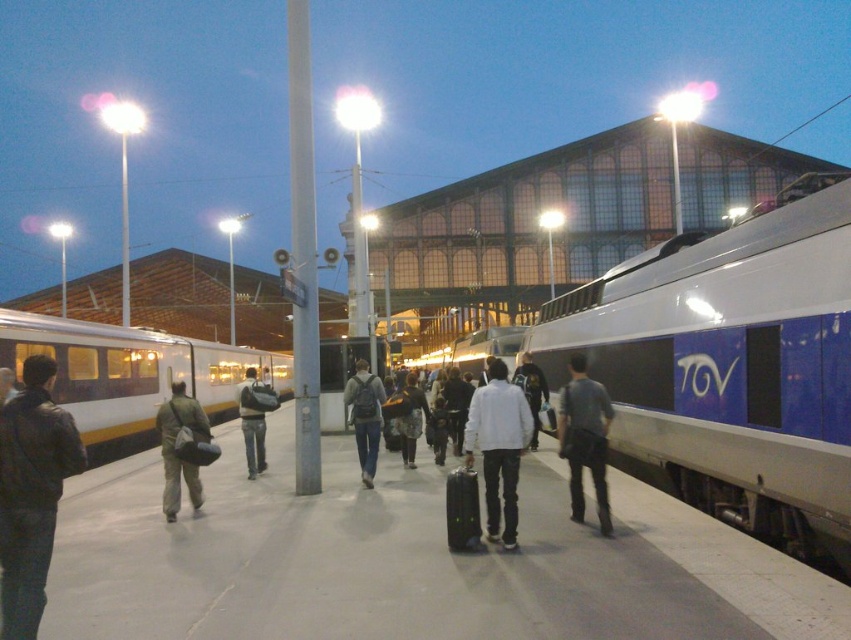
Question: Is white matte jacket at center below silver metallic train at center?

Choices:
 (A) no
 (B) yes

Answer: (B)

Question: Which object is positioned farthest from the silver metallic train at center?

Choices:
 (A) blue glossy train at right
 (B) khaki pants at center

Answer: (B)

Question: Is khaki pants at center closer to the viewer compared to denim jacket at center?

Choices:
 (A) yes
 (B) no

Answer: (A)

Question: Which object appears closest to the camera in this image?

Choices:
 (A) white matte jacket at center
 (B) gray fabric bag at center

Answer: (A)

Question: Can you confirm if leather jacket at left is positioned below silver metallic train at center?

Choices:
 (A) yes
 (B) no

Answer: (B)

Question: Considering the real-world distances, which object is farthest from the blue glossy train at right?

Choices:
 (A) leather jacket at left
 (B) denim backpack at center
 (C) silver metallic train at center
 (D) denim jacket at center

Answer: (C)